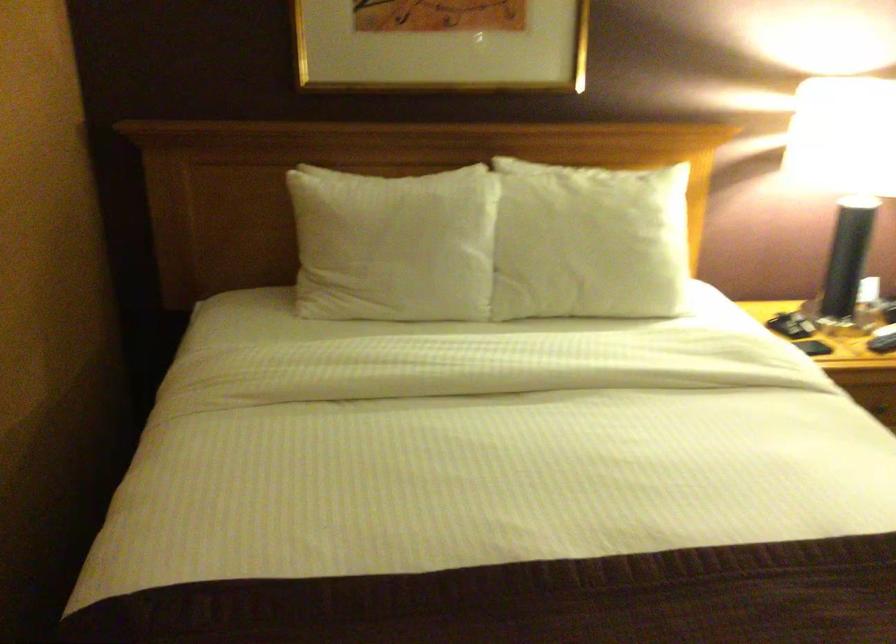
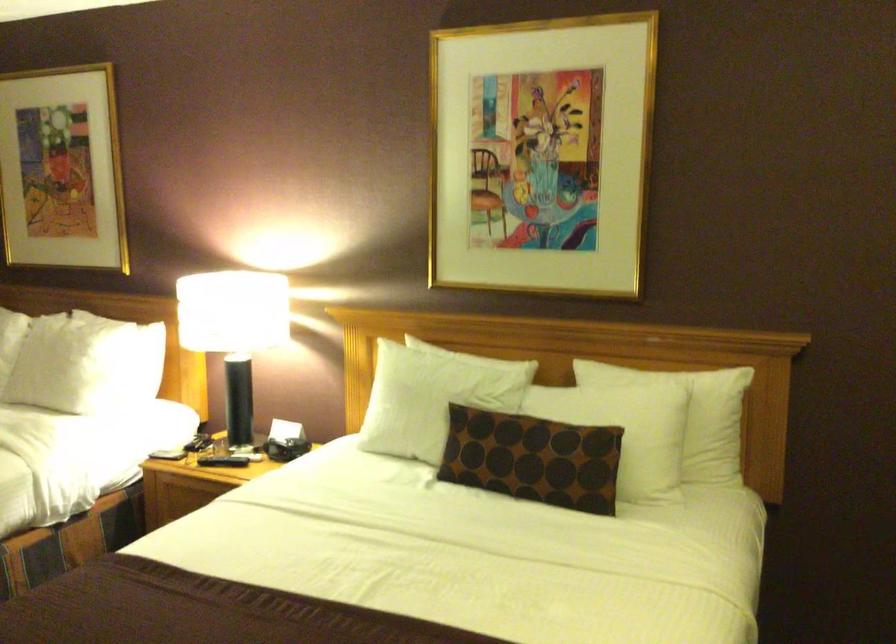
Find the pixel in the second image that matches [668,245] in the first image.

(73, 364)